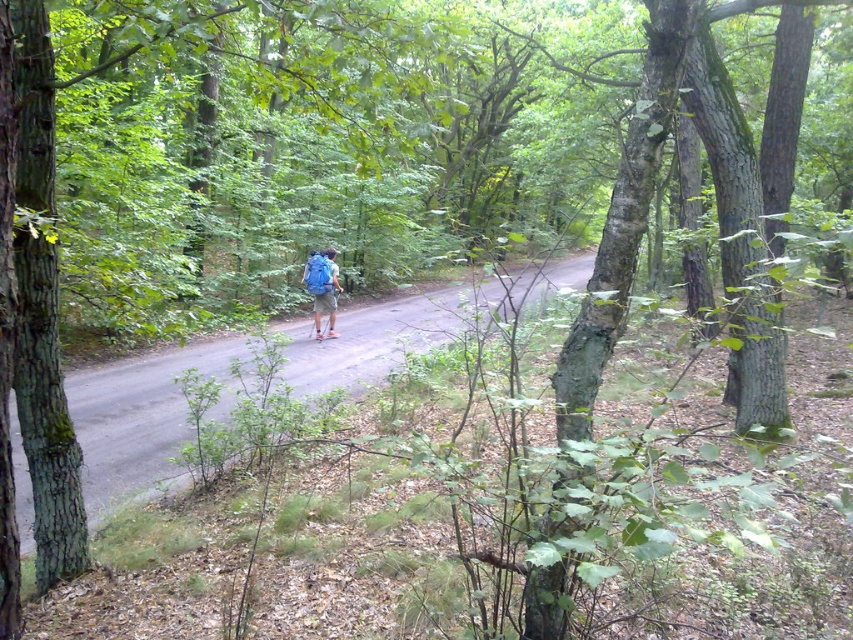
In the scene shown: Who is shorter, smooth asphalt road at center or blue fabric backpack at center?

With less height is blue fabric backpack at center.

Describe the element at coordinates (138, 419) in the screenshot. I see `smooth asphalt road at center` at that location.

Where is `smooth asphalt road at center`? This screenshot has width=853, height=640. smooth asphalt road at center is located at coordinates (138, 419).